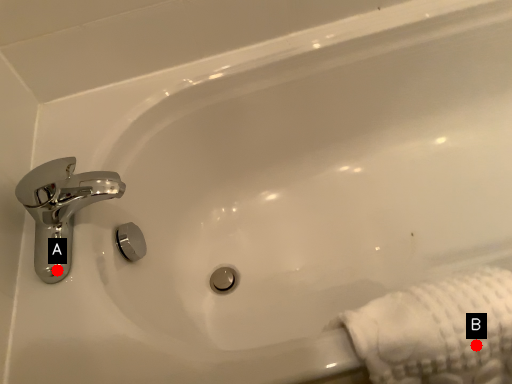
Question: Two points are circled on the image, labeled by A and B beside each circle. Which point is closer to the camera?

Choices:
 (A) A is closer
 (B) B is closer

Answer: (B)